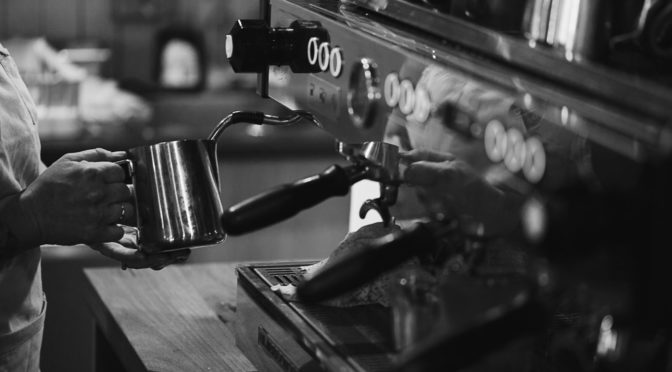
Where is `espresso machine`? This screenshot has height=372, width=672. espresso machine is located at coordinates (439, 84).